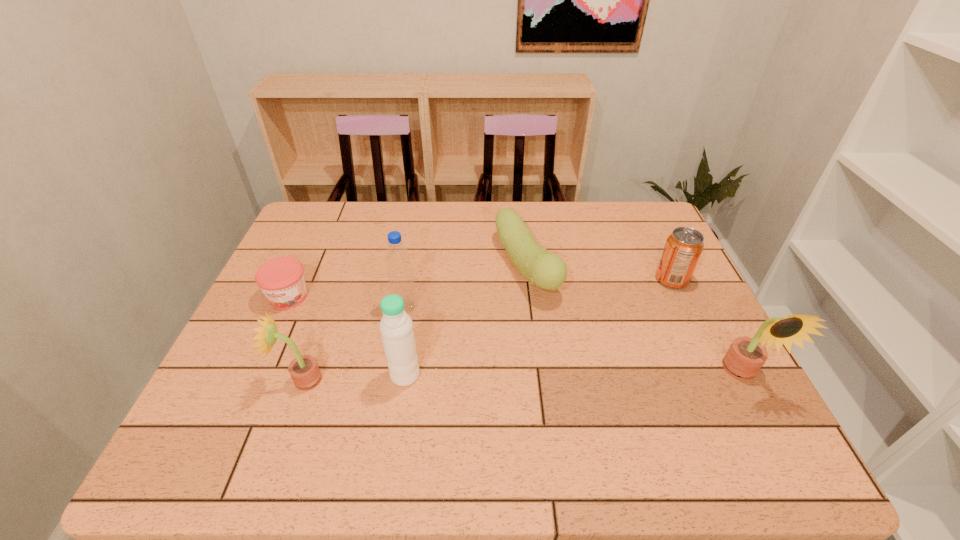
You are a GUI agent. You are given a task and a screenshot of the screen. Output one action in this format:
    pyautogui.click(x=<x>, y=<y>)
    Task: Click on the free point at the far right corner
    Image resolution: width=960 pixels, height=540 pixels.
    Given the screenshot: What is the action you would take?
    pyautogui.click(x=630, y=233)

At what (x,y) coordinates should I click in order to perform the action: click on empty space that is in between the farther water bottle and the right sunflower. Please return your answer as a coordinate pair (x, y). Looking at the image, I should click on (574, 340).

This screenshot has height=540, width=960. I want to click on empty space that is in between the third object from right to left and the soda can, so click(599, 273).

At what (x,y) coordinates should I click in order to perform the action: click on unoccupied position between the sixth tallest object and the soda can. Please return your answer as a coordinate pair (x, y). Looking at the image, I should click on (599, 273).

The height and width of the screenshot is (540, 960). What are the coordinates of `free spot between the soda can and the farther water bottle` in the screenshot? It's located at (539, 293).

Find the location of a particular element. The height and width of the screenshot is (540, 960). empty space between the fourth shortest object and the taller sunflower is located at coordinates (522, 377).

Identify the location of vacant area that lies between the leftmost object and the farther water bottle. (347, 302).

This screenshot has width=960, height=540. In order to click on blank region between the shortest object and the nearer water bottle in this screenshot , I will do `click(347, 336)`.

What are the coordinates of `vacant space in between the fourth tallest object and the taller sunflower` in the screenshot? It's located at (522, 377).

Locate an element on the screen. The image size is (960, 540). free space between the right sunflower and the left sunflower is located at coordinates (522, 377).